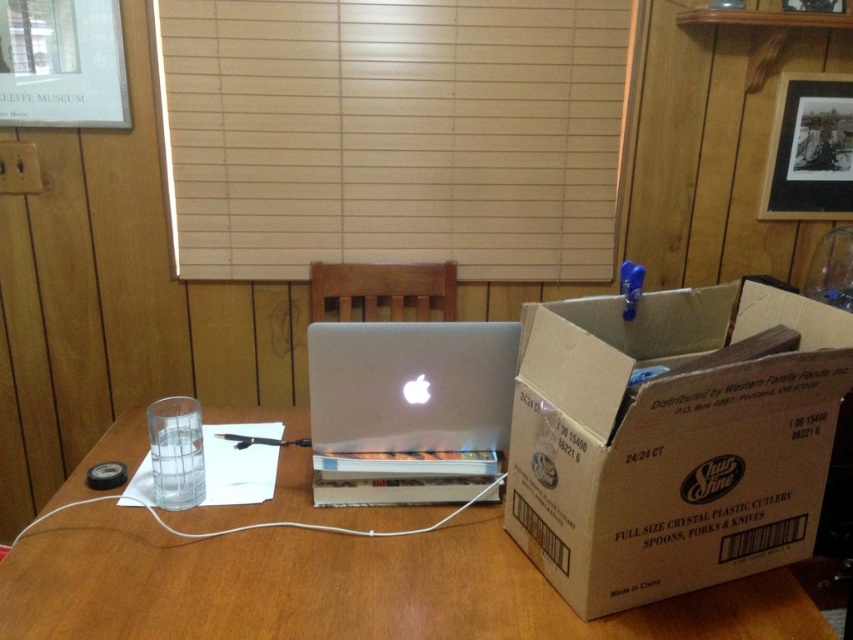
Question: Which point appears farthest from the camera in this image?

Choices:
 (A) [x=412, y=470]
 (B) [x=3, y=568]
 (C) [x=653, y=563]

Answer: (A)

Question: Observing the image, what is the correct spatial positioning of brown cardboard box at right in reference to wooden table at center?

Choices:
 (A) right
 (B) left

Answer: (A)

Question: Considering the real-world distances, which object is farthest from the silver metallic laptop at center?

Choices:
 (A) wooden table at center
 (B) brown cardboard box at right

Answer: (B)

Question: Which object is the closest to the silver metallic laptop at center?

Choices:
 (A) wooden table at center
 (B) brown cardboard box at right

Answer: (A)

Question: Is brown cardboard box at right to the left of wooden table at center from the viewer's perspective?

Choices:
 (A) yes
 (B) no

Answer: (B)

Question: Does brown cardboard box at right have a larger size compared to silver metallic laptop at center?

Choices:
 (A) no
 (B) yes

Answer: (B)